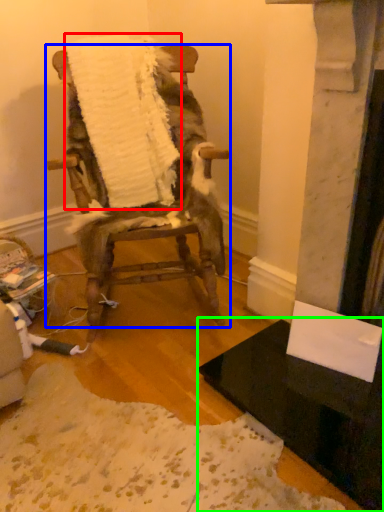
Question: Which object is positioned closest to blanket (highlighted by a red box)? Select from chair (highlighted by a blue box) and table (highlighted by a green box).

Choices:
 (A) chair
 (B) table

Answer: (A)